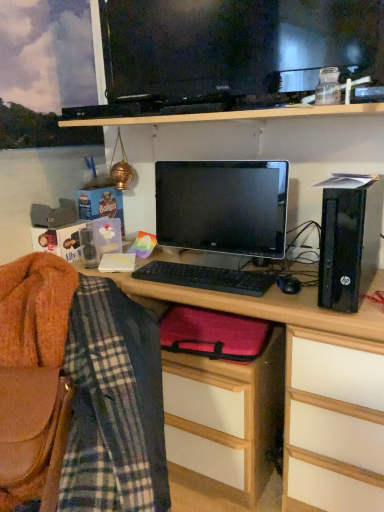
This screenshot has height=512, width=384. What are the coordinates of `free point in front of black plastic mouse at center` in the screenshot? It's located at (313, 303).